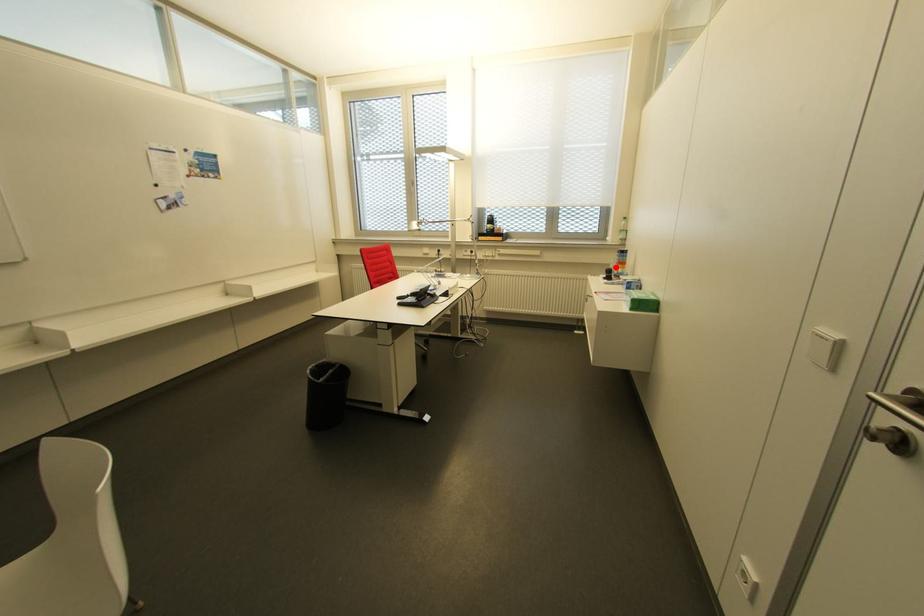
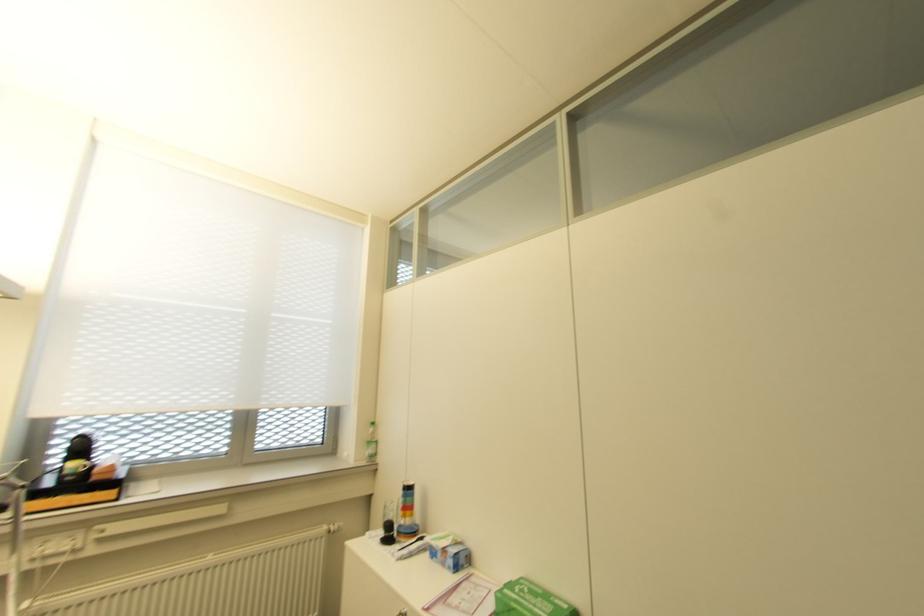
Find the pixel in the second image that matches the highlighted location in the first image.

(402, 517)